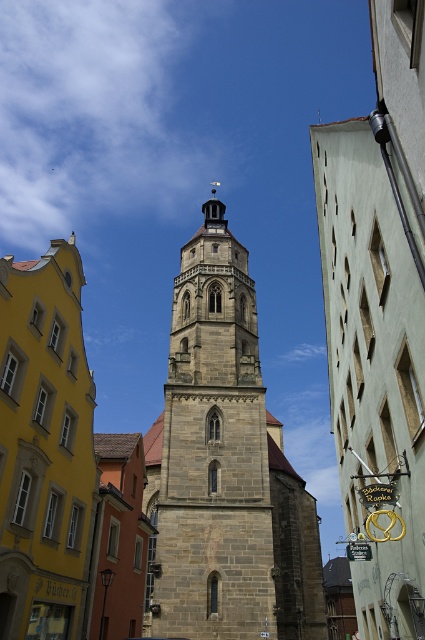
Can you confirm if gray stone tower at center is shorter than stone church at left?

Incorrect, gray stone tower at center's height does not fall short of stone church at left's.

Locate an element on the screen. gray stone tower at center is located at coordinates (212, 452).

Measure the distance between gray stone tower at center and camera.

The distance of gray stone tower at center from camera is 155.27 feet.

This screenshot has width=425, height=640. What are the coordinates of `gray stone tower at center` in the screenshot? It's located at (212, 452).